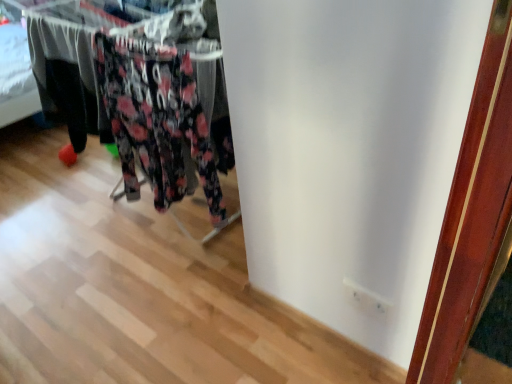
Image resolution: width=512 pixels, height=384 pixels. Identify the location of floral fabric pants at left. (131, 103).

Describe the element at coordinates (131, 103) in the screenshot. I see `floral fabric pants at left` at that location.

At what (x,y) coordinates should I click in order to perform the action: click on floral fabric pants at left. Please return your answer as a coordinate pair (x, y). The height and width of the screenshot is (384, 512). Looking at the image, I should click on (131, 103).